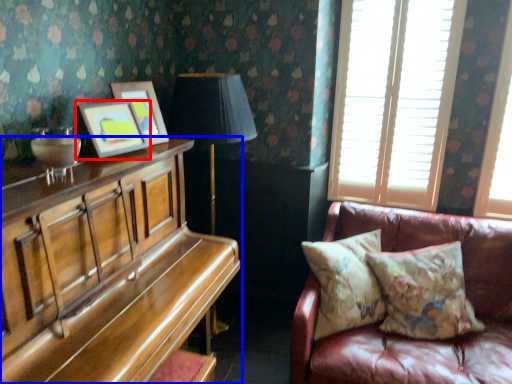
Question: Among these objects, which one is farthest to the camera, picture frame (highlighted by a red box) or piano (highlighted by a blue box)?

Choices:
 (A) picture frame
 (B) piano

Answer: (A)